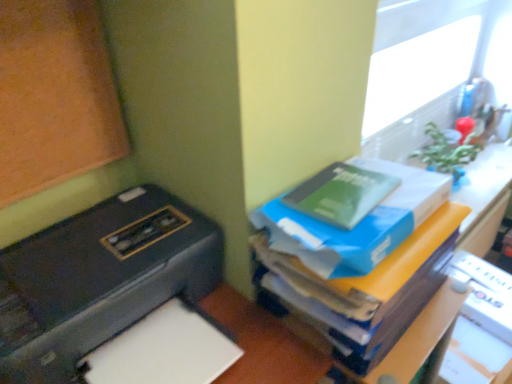
Measure the distance between black plastic printer at left and camera.

23.51 inches.

The image size is (512, 384). I want to click on green matte book at upper right, the first paperback book ordered from the bottom, so click(356, 225).

In order to face white paper at lower left, should I rotate leftwards or rightwards?

To face it directly, rotate left by 11.837 degrees.

Measure the distance between point (5, 88) and camera.

A distance of 30.16 inches exists between point (5, 88) and camera.

Locate an element on the screen. The height and width of the screenshot is (384, 512). blue cardboard box at upper right is located at coordinates (387, 260).

This screenshot has width=512, height=384. I want to click on black plastic printer at left, so click(x=115, y=297).

Is wooden bulletin board at left in front of or behind green matte book at upper right, acting as the second paperback book starting from the bottom, in the image?

Clearly, wooden bulletin board at left is in front of green matte book at upper right, acting as the second paperback book starting from the bottom.

From a real-world perspective, is wooden bulletin board at left physically below green matte book at upper right, placed as the 1th paperback book when sorted from top to bottom?

No, from a real-world perspective, wooden bulletin board at left is not under green matte book at upper right, placed as the 1th paperback book when sorted from top to bottom.

Which is in front, point (112, 113) or point (362, 189)?

The point (362, 189) is more forward.

In the scene shown: From the image's perspective, is wooden bulletin board at left located beneath green matte book at upper right, placed as the 1th paperback book when sorted from top to bottom?

Actually, wooden bulletin board at left appears above green matte book at upper right, placed as the 1th paperback book when sorted from top to bottom, in the image.

Which is correct: blue cardboard box at upper right is inside wooden bulletin board at left, or outside of it?

blue cardboard box at upper right is not enclosed by wooden bulletin board at left.

In the image, there is a wooden bulletin board at left. Identify the location of furniture below it (from the image's perspective). The height and width of the screenshot is (384, 512). (387, 260).

Considering the sizes of objects blue cardboard box at upper right and wooden bulletin board at left in the image provided, who is thinner, blue cardboard box at upper right or wooden bulletin board at left?

wooden bulletin board at left is thinner.

Is blue cardboard box at upper right with wooden bulletin board at left?

blue cardboard box at upper right is not next to wooden bulletin board at left, and they're not touching.

From the picture: Is white paper at lower left wider or thinner than wooden bulletin board at left?

In the image, white paper at lower left appears to be wider than wooden bulletin board at left.

How different are the orientations of white paper at lower left and wooden bulletin board at left in degrees?

0.000464 degrees.

Based on the photo, are white paper at lower left and wooden bulletin board at left far apart?

white paper at lower left is actually quite close to wooden bulletin board at left.

Does white paper at lower left have a lesser height compared to wooden bulletin board at left?

Correct, white paper at lower left is not as tall as wooden bulletin board at left.

Is wooden bulletin board at left taller than green matte book at upper right, the second paperback book positioned from the top?

Indeed, wooden bulletin board at left has a greater height compared to green matte book at upper right, the second paperback book positioned from the top.

In the scene shown: Between wooden bulletin board at left and green matte book at upper right, the first paperback book ordered from the bottom, which one has larger size?

With larger size is wooden bulletin board at left.

Find the location of a particular element. Image resolution: width=512 pixels, height=384 pixels. paperback book that is the 2nd object to the right of the wooden bulletin board at left, starting at the anchor is located at coordinates (356, 225).

Is black plastic printer at left taller or shorter than blue cardboard box at upper right?

Clearly, black plastic printer at left is shorter compared to blue cardboard box at upper right.

Is point (163, 265) positioned after point (255, 245)?

No, (163, 265) is closer to viewer.

From the picture: Are black plastic printer at left and blue cardboard box at upper right located far from each other?

black plastic printer at left is actually quite close to blue cardboard box at upper right.

Does black plastic printer at left turn towards blue cardboard box at upper right?

No.

From a real-world perspective, which is physically below, black plastic printer at left or green matte book at upper right, placed as the 1th paperback book when sorted from top to bottom?

From a 3D spatial view, black plastic printer at left is below.

Is black plastic printer at left inside or outside of green matte book at upper right, acting as the second paperback book starting from the bottom?

The correct answer is: outside.

How much distance is there between black plastic printer at left and green matte book at upper right, placed as the 1th paperback book when sorted from top to bottom?

32.33 centimeters.

How different are the orientations of black plastic printer at left and green matte book at upper right, acting as the second paperback book starting from the bottom, in degrees?

black plastic printer at left and green matte book at upper right, acting as the second paperback book starting from the bottom, are facing 2.25 degrees away from each other.

From the image's perspective, would you say white paper at lower left is shown under green matte book at upper right, the second paperback book positioned from the top?

Indeed, from the image's perspective, white paper at lower left is shown beneath green matte book at upper right, the second paperback book positioned from the top.

Considering the sizes of objects white paper at lower left and green matte book at upper right, the second paperback book positioned from the top, in the image provided, who is taller, white paper at lower left or green matte book at upper right, the second paperback book positioned from the top,?

green matte book at upper right, the second paperback book positioned from the top, is taller.

How different are the orientations of white paper at lower left and green matte book at upper right, the second paperback book positioned from the top, in degrees?

The facing directions of white paper at lower left and green matte book at upper right, the second paperback book positioned from the top, are 2.25 degrees apart.

This screenshot has height=384, width=512. I want to click on paper below the green matte book at upper right, the second paperback book positioned from the top (from a real-world perspective), so [163, 351].

From the wooden bulletin board at left, count 2nd paperback books backward and point to it. Please provide its 2D coordinates.

[(341, 194)]

In the image, there is a wooden bulletin board at left. At what (x,y) coordinates should I click in order to perform the action: click on furniture below it (from a real-world perspective). Please return your answer as a coordinate pair (x, y). This screenshot has width=512, height=384. Looking at the image, I should click on (387, 260).

Based on their spatial positions, is wooden bulletin board at left or white paper at lower left further from green matte book at upper right, acting as the second paperback book starting from the bottom?

wooden bulletin board at left.

When comparing their distances from white paper at lower left, does black plastic printer at left or blue cardboard box at upper right seem closer?

Among the two, black plastic printer at left is located nearer to white paper at lower left.

Looking at this image, looking at the image, which one is located further to white paper at lower left, black plastic printer at left or wooden bulletin board at left?

wooden bulletin board at left is positioned further to the anchor white paper at lower left.

Considering their positions, is wooden bulletin board at left positioned further to green matte book at upper right, placed as the 1th paperback book when sorted from top to bottom, than black plastic printer at left?

wooden bulletin board at left.

When comparing their distances from green matte book at upper right, the second paperback book positioned from the top, does green matte book at upper right, acting as the second paperback book starting from the bottom, or wooden bulletin board at left seem further?

wooden bulletin board at left is positioned further to the anchor green matte book at upper right, the second paperback book positioned from the top.

Estimate the real-world distances between objects in this image. Which object is further from blue cardboard box at upper right, black plastic printer at left or green matte book at upper right, the first paperback book ordered from the bottom?

black plastic printer at left.

When comparing their distances from black plastic printer at left, does green matte book at upper right, acting as the second paperback book starting from the bottom, or white paper at lower left seem closer?

white paper at lower left.

Looking at the image, which one is located closer to green matte book at upper right, placed as the 1th paperback book when sorted from top to bottom, wooden bulletin board at left or blue cardboard box at upper right?

The object closer to green matte book at upper right, placed as the 1th paperback book when sorted from top to bottom, is blue cardboard box at upper right.

Locate an element on the screen. paper between black plastic printer at left and green matte book at upper right, acting as the second paperback book starting from the bottom, in the horizontal direction is located at coordinates (163, 351).

The width and height of the screenshot is (512, 384). I want to click on furniture between white paper at lower left and green matte book at upper right, the second paperback book positioned from the top, so click(387, 260).

You are a GUI agent. You are given a task and a screenshot of the screen. Output one action in this format:
    pyautogui.click(x=<x>, y=<y>)
    Task: Click on the paper between wooden bulletin board at left and green matte book at upper right, acting as the second paperback book starting from the bottom
    
    Given the screenshot: What is the action you would take?
    pyautogui.click(x=163, y=351)

At what (x,y) coordinates should I click in order to perform the action: click on printer located between wooden bulletin board at left and blue cardboard box at upper right in the left-right direction. Please return your answer as a coordinate pair (x, y). The height and width of the screenshot is (384, 512). Looking at the image, I should click on (115, 297).